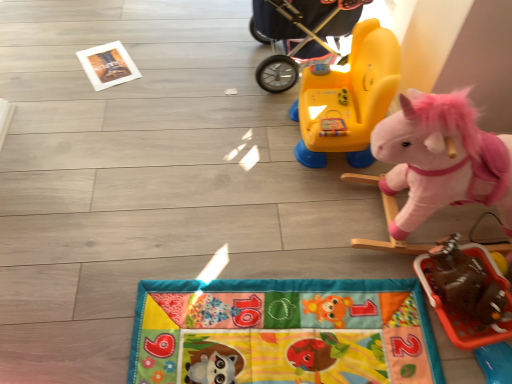
Question: Should I look upward or downward to see yellow plastic baby carriage at upper center?

Choices:
 (A) up
 (B) down

Answer: (A)

Question: Is yellow plastic baby carriage at upper center surrounding pink plush unicorn at right, positioned as the 2th toy in top-to-bottom order?

Choices:
 (A) no
 (B) yes

Answer: (A)

Question: Considering the relative positions of yellow plastic baby carriage at upper center and pink plush unicorn at right, marked as the 2th toy in a bottom-to-top arrangement, in the image provided, is yellow plastic baby carriage at upper center to the left of pink plush unicorn at right, marked as the 2th toy in a bottom-to-top arrangement, from the viewer's perspective?

Choices:
 (A) no
 (B) yes

Answer: (B)

Question: Considering the relative sizes of yellow plastic baby carriage at upper center and pink plush unicorn at right, positioned as the 2th toy in top-to-bottom order, in the image provided, is yellow plastic baby carriage at upper center bigger than pink plush unicorn at right, positioned as the 2th toy in top-to-bottom order,?

Choices:
 (A) yes
 (B) no

Answer: (A)

Question: Considering the relative sizes of yellow plastic baby carriage at upper center and pink plush unicorn at right, marked as the 2th toy in a bottom-to-top arrangement, in the image provided, is yellow plastic baby carriage at upper center shorter than pink plush unicorn at right, marked as the 2th toy in a bottom-to-top arrangement,?

Choices:
 (A) no
 (B) yes

Answer: (B)

Question: From a real-world perspective, does yellow plastic baby carriage at upper center stand above pink plush unicorn at right, positioned as the 2th toy in top-to-bottom order?

Choices:
 (A) yes
 (B) no

Answer: (B)

Question: Would you say yellow plastic baby carriage at upper center is outside pink plush unicorn at right, positioned as the 2th toy in top-to-bottom order?

Choices:
 (A) no
 (B) yes

Answer: (B)

Question: Considering the relative sizes of yellow plastic baby carriage at upper center and yellow plastic rocker at upper center, which appears as the 1th toy when viewed from the top, in the image provided, is yellow plastic baby carriage at upper center shorter than yellow plastic rocker at upper center, which appears as the 1th toy when viewed from the top,?

Choices:
 (A) yes
 (B) no

Answer: (B)

Question: Does yellow plastic baby carriage at upper center have a smaller size compared to yellow plastic rocker at upper center, which appears as the 1th toy when viewed from the top?

Choices:
 (A) yes
 (B) no

Answer: (B)

Question: Can you see yellow plastic baby carriage at upper center touching yellow plastic rocker at upper center, which appears as the 1th toy when viewed from the top?

Choices:
 (A) yes
 (B) no

Answer: (B)

Question: Can you confirm if yellow plastic baby carriage at upper center is bigger than yellow plastic rocker at upper center, which appears as the 1th toy when viewed from the top?

Choices:
 (A) no
 (B) yes

Answer: (B)

Question: Is yellow plastic baby carriage at upper center to the left of yellow plastic rocker at upper center, which appears as the 1th toy when viewed from the top, from the viewer's perspective?

Choices:
 (A) no
 (B) yes

Answer: (B)

Question: Can you confirm if yellow plastic baby carriage at upper center is thinner than yellow plastic rocker at upper center, which appears as the 1th toy when viewed from the top?

Choices:
 (A) no
 (B) yes

Answer: (A)

Question: Is there a large distance between yellow plastic rocker at upper center, the 3th toy when ordered from bottom to top, and yellow plastic baby carriage at upper center?

Choices:
 (A) no
 (B) yes

Answer: (A)